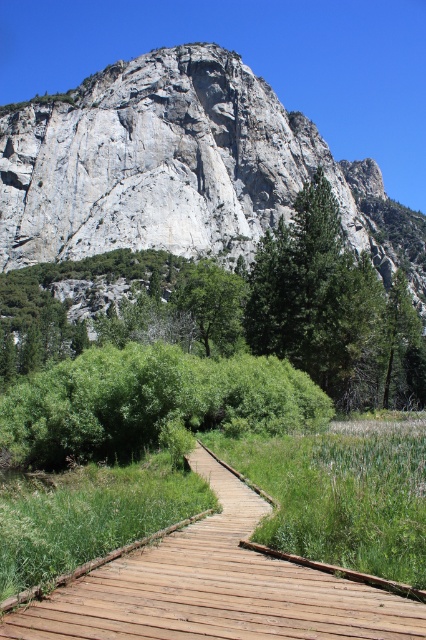
Question: Is gray rock formation at upper center above green leafy tree at center?

Choices:
 (A) yes
 (B) no

Answer: (A)

Question: Based on their relative distances, which object is nearer to the gray rock formation at upper center?

Choices:
 (A) brown wooden boardwalk at center
 (B) green leafy tree at center

Answer: (B)

Question: Is brown wooden boardwalk at center below green leafy tree at center?

Choices:
 (A) no
 (B) yes

Answer: (B)

Question: Which is farther from the brown wooden boardwalk at center?

Choices:
 (A) gray rock formation at upper center
 (B) green leafy tree at center

Answer: (A)

Question: Does gray rock formation at upper center appear on the right side of green leafy tree at center?

Choices:
 (A) yes
 (B) no

Answer: (A)

Question: Which object is farther from the camera taking this photo?

Choices:
 (A) green leafy tree at center
 (B) brown wooden boardwalk at center
 (C) gray rock formation at upper center

Answer: (C)